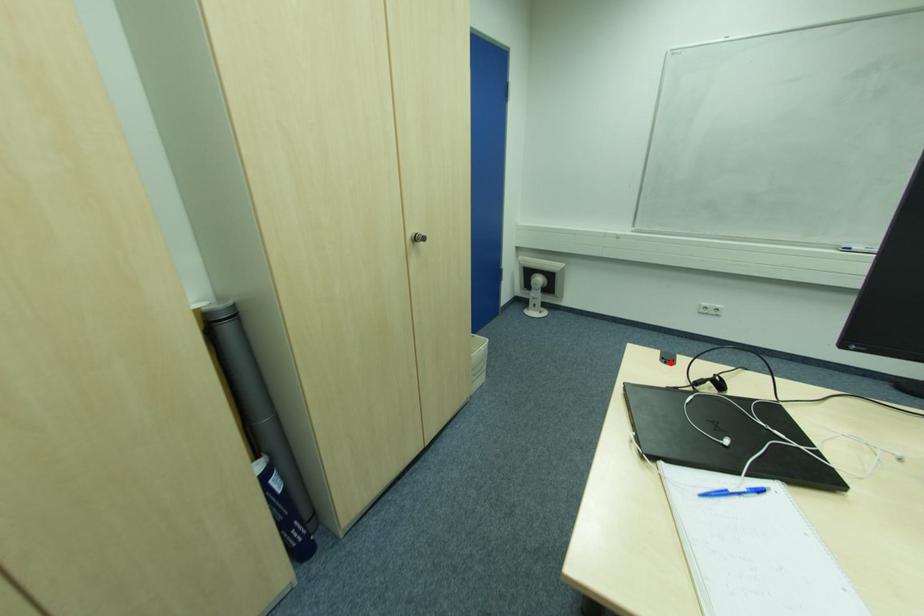
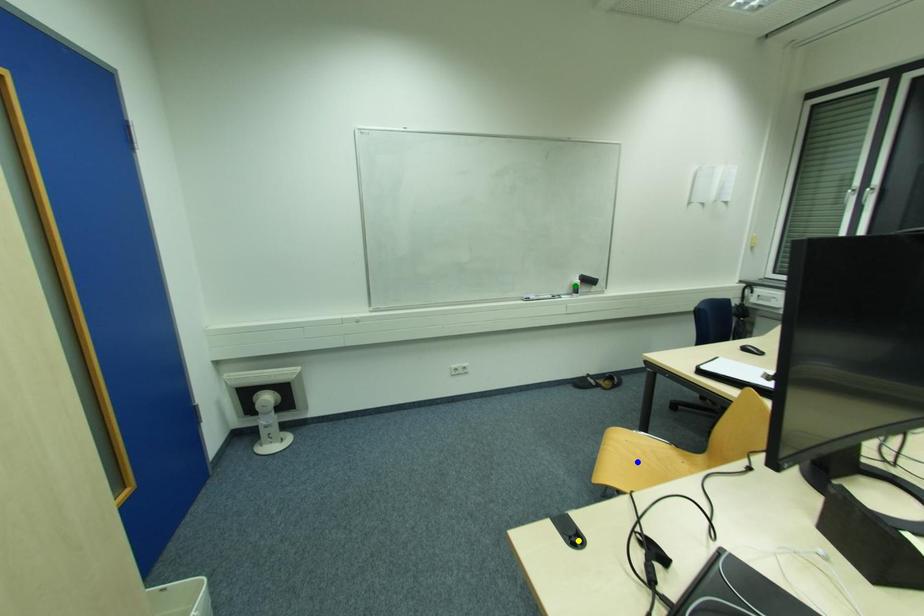
Question: I am providing you with two images of the same scene from different viewpoints. A red point is marked on the first image. You are given multiple points on the second image. Which mark in image 2 goes with the point in image 1?

Choices:
 (A) yellow point
 (B) blue point
 (C) green point

Answer: (A)